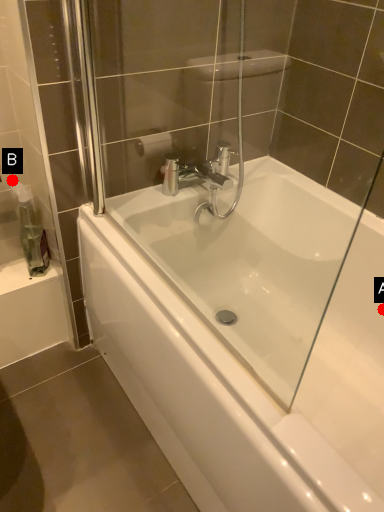
Question: Two points are circled on the image, labeled by A and B beside each circle. Which point appears closest to the camera in this image?

Choices:
 (A) A is closer
 (B) B is closer

Answer: (B)